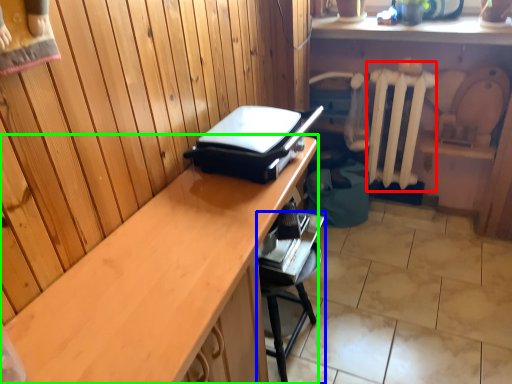
Question: Which object is positioned closest to radiator (highlighted by a red box)? Select from furniture (highlighted by a blue box) and desk (highlighted by a green box).

Choices:
 (A) furniture
 (B) desk

Answer: (A)